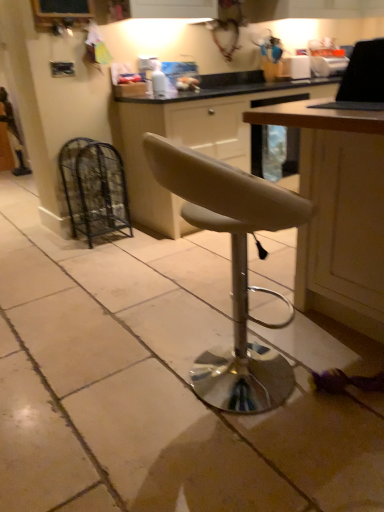
Where is `vacant space situated on the left part of beige leather stool at center`? The width and height of the screenshot is (384, 512). vacant space situated on the left part of beige leather stool at center is located at coordinates (104, 395).